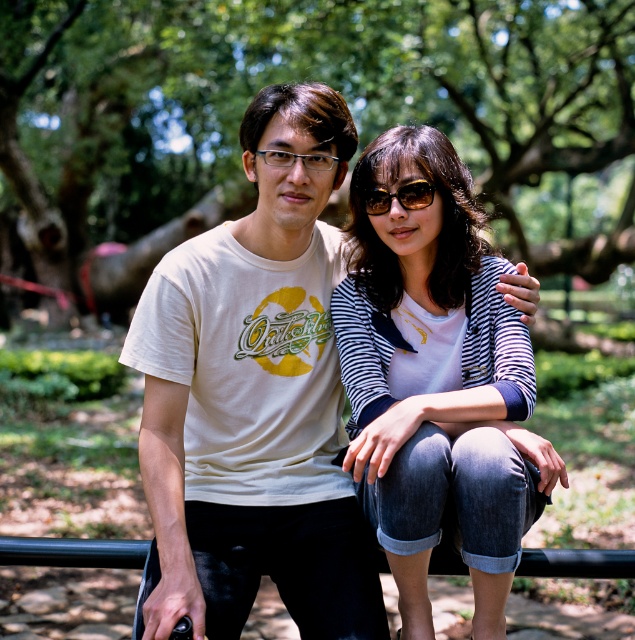
You are standing in the park and want to place a small decorative rock exactly halfway between point [497,333] and point [271,150]. Which point is closer to the rock once placed?

Point [497,333] is closer to the rock because it is closer to the viewer than point [271,150].